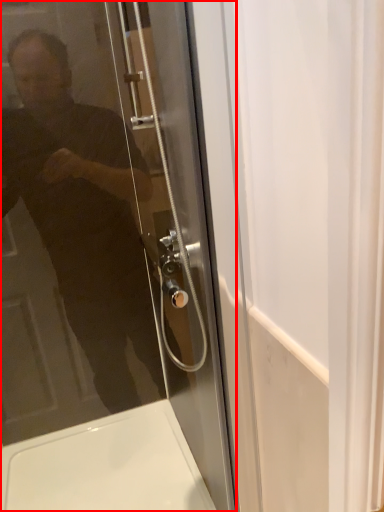
Question: From the image, what is the correct spatial relationship of door (annotated by the red box) in relation to bath?

Choices:
 (A) left
 (B) right

Answer: (B)